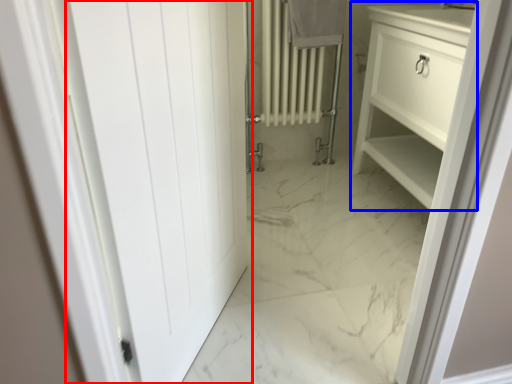
Question: Which point is further to the camera, door (highlighted by a red box) or bathroom cabinet (highlighted by a blue box)?

Choices:
 (A) door
 (B) bathroom cabinet

Answer: (B)